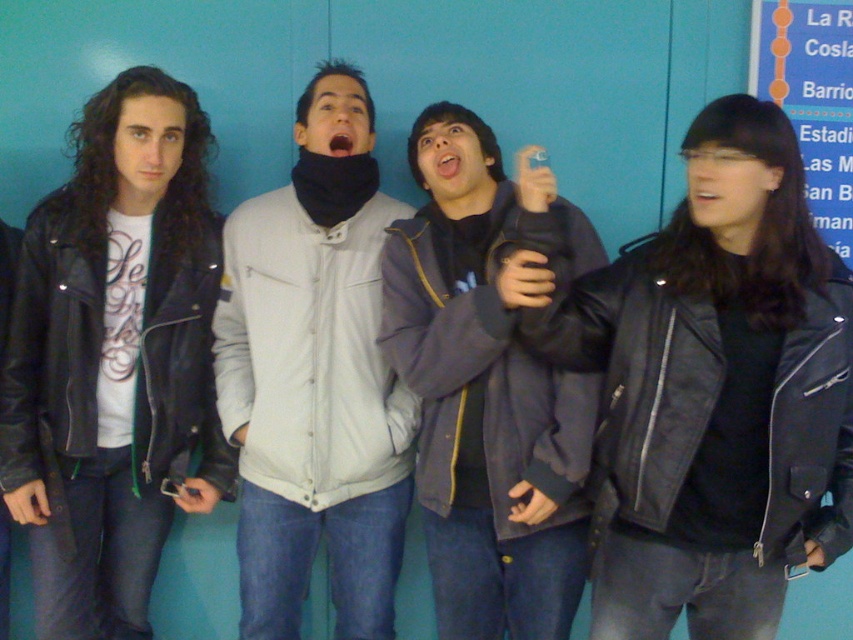
Can you confirm if black leather jacket at right is taller than matte black leather jacket at left?

No.

Where is `black leather jacket at right`? black leather jacket at right is located at coordinates [x=715, y=392].

Does point (612, 352) come farther from viewer compared to point (138, 228)?

No, (612, 352) is closer to viewer.

At what (x,y) coordinates should I click in order to perform the action: click on black leather jacket at right. Please return your answer as a coordinate pair (x, y). Looking at the image, I should click on (715, 392).

Which of these two, dark blue leather jacket at center or blue paper at upper right, stands shorter?

blue paper at upper right is shorter.

The image size is (853, 640). Describe the element at coordinates (485, 400) in the screenshot. I see `dark blue leather jacket at center` at that location.

At what (x,y) coordinates should I click in order to perform the action: click on dark blue leather jacket at center. Please return your answer as a coordinate pair (x, y). This screenshot has height=640, width=853. Looking at the image, I should click on (485, 400).

Does black leather jacket at right appear under dark blue leather jacket at center?

Yes, black leather jacket at right is below dark blue leather jacket at center.

Can you confirm if black leather jacket at right is thinner than dark blue leather jacket at center?

Incorrect, black leather jacket at right's width is not less than dark blue leather jacket at center's.

Is point (726, 326) in front of point (564, 634)?

Yes, it is in front of point (564, 634).

The image size is (853, 640). I want to click on black leather jacket at right, so click(x=715, y=392).